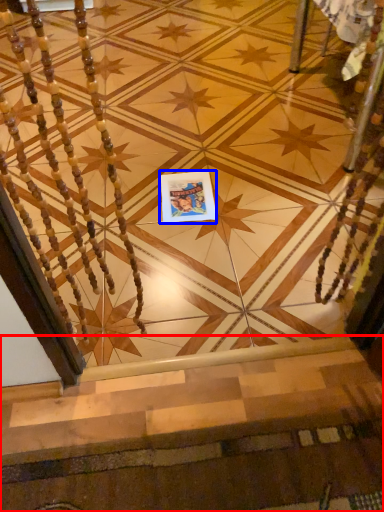
Question: Among these objects, which one is farthest to the camera, stairs (highlighted by a red box) or postcard (highlighted by a blue box)?

Choices:
 (A) stairs
 (B) postcard

Answer: (B)